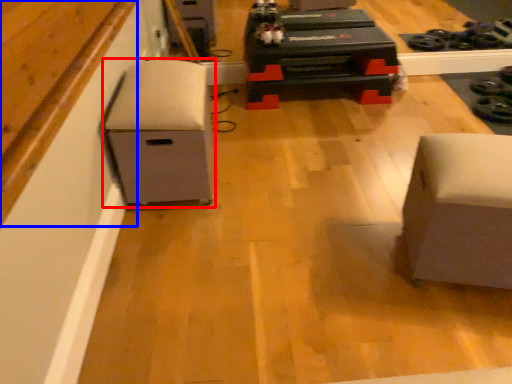
Question: Which of the following is the farthest to the observer, furniture (highlighted by a red box) or wood (highlighted by a blue box)?

Choices:
 (A) furniture
 (B) wood

Answer: (A)